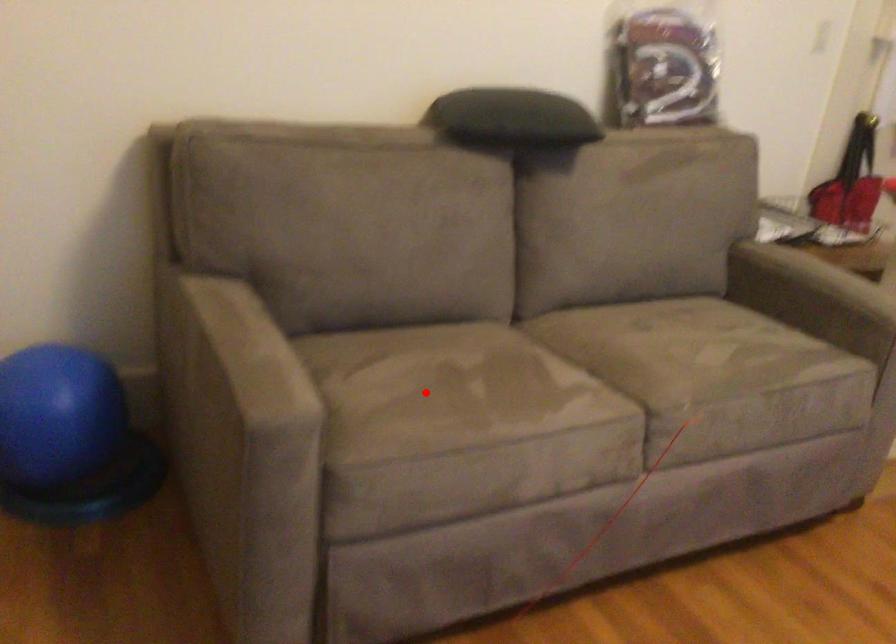
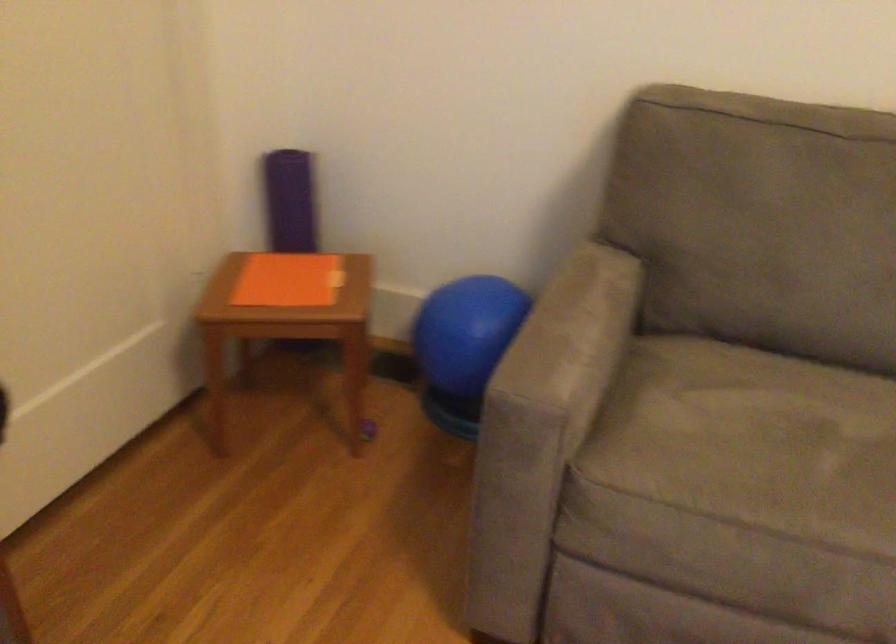
Question: I am providing you with two images of the same scene from different viewpoints. Image1 has a red point marked. In image2, the corresponding 3D location appears at what relative position? Reply with the corresponding letter.

Choices:
 (A) Closer
 (B) Farther

Answer: (A)